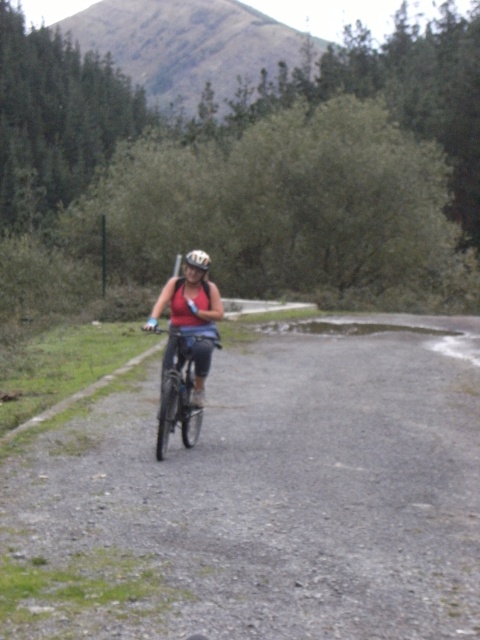
Question: Which object is closer to the camera taking this photo?

Choices:
 (A) gravel road at center
 (B) shiny metallic bicycle at center
 (C) matte black helmet at center

Answer: (A)

Question: Among these points, which one is farthest from the camera?

Choices:
 (A) [197, 264]
 (B) [182, 342]
 (C) [405, 557]

Answer: (A)

Question: Where is shiny metallic bicycle at center located in relation to matte black helmet at center in the image?

Choices:
 (A) above
 (B) below

Answer: (B)

Question: Does shiny metallic bicycle at center appear on the left side of matte black helmet at center?

Choices:
 (A) yes
 (B) no

Answer: (B)

Question: Does shiny metallic bicycle at center appear over matte black helmet at center?

Choices:
 (A) yes
 (B) no

Answer: (B)

Question: Which object is the closest to the shiny metallic bicycle at center?

Choices:
 (A) gravel road at center
 (B) matte black helmet at center

Answer: (A)